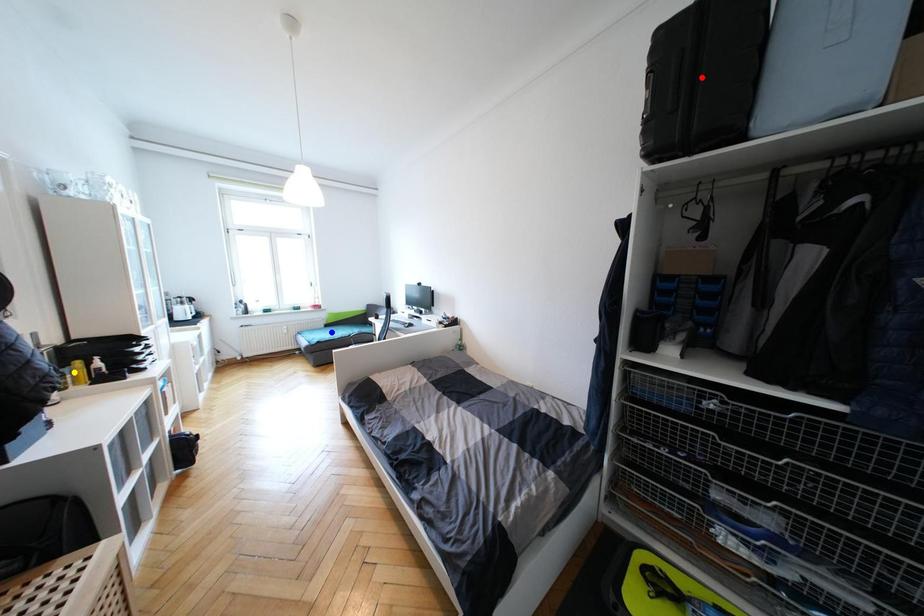
Order these from farthest to nearest:
- yellow point
- red point
- blue point

blue point, red point, yellow point